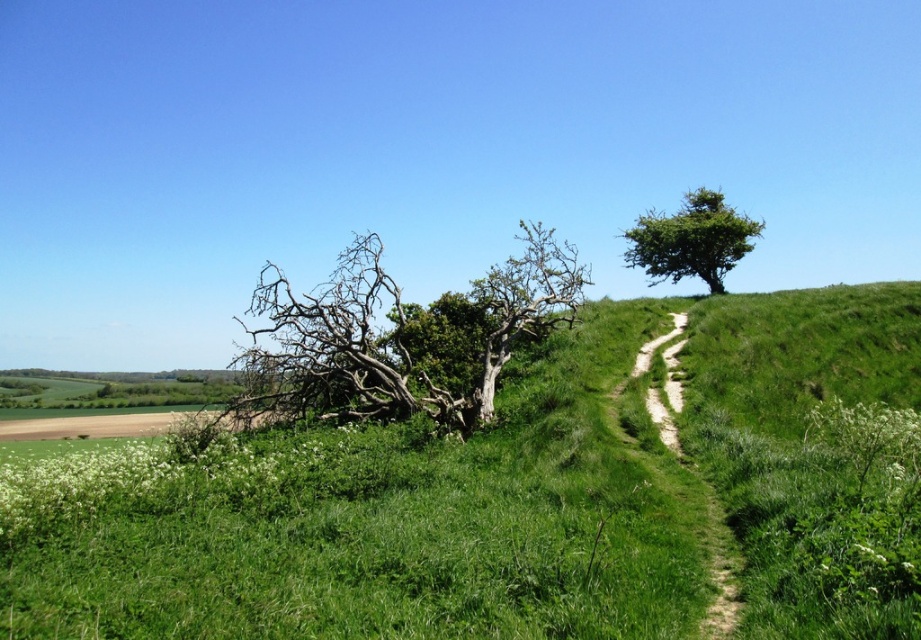
Question: Among these points, which one is farthest from the camera?

Choices:
 (A) (857, 360)
 (B) (670, 406)
 (C) (735, 253)
 (D) (568, 248)

Answer: (C)

Question: Which point appears closest to the camera in this image?

Choices:
 (A) (715, 321)
 (B) (644, 259)

Answer: (A)

Question: Is bare wood tree at center-left closer to the viewer compared to green leafy tree at upper right?

Choices:
 (A) no
 (B) yes

Answer: (B)

Question: Is bare wood tree at center-left positioned behind dirt path at center-right?

Choices:
 (A) yes
 (B) no

Answer: (A)

Question: Can you confirm if green grassy hillside at center is smaller than bare wood tree at center-left?

Choices:
 (A) no
 (B) yes

Answer: (A)

Question: Which object is the closest to the dirt path at center-right?

Choices:
 (A) green leafy tree at upper right
 (B) bare wood tree at center-left
 (C) green grassy hillside at center

Answer: (C)